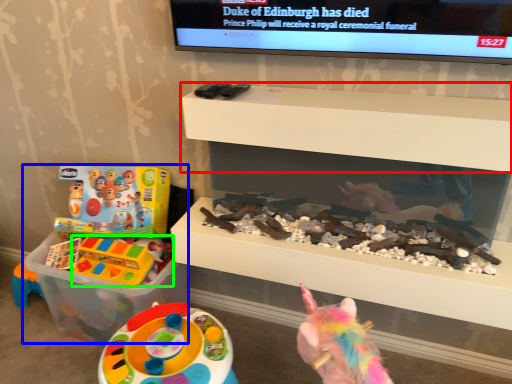
Question: Considering the real-world distances, which object is farthest from shelf (highlighted by a red box)? toy (highlighted by a blue box) or toy (highlighted by a green box)?

Choices:
 (A) toy
 (B) toy

Answer: (B)